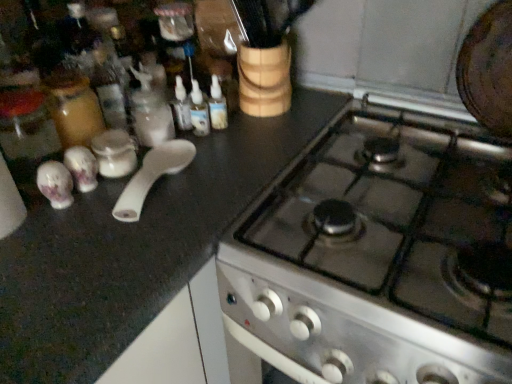
In order to click on white glossy spoon at upper left in this screenshot , I will do `click(114, 153)`.

What do you see at coordinates (400, 221) in the screenshot? This screenshot has width=512, height=384. I see `metallic silver gas stove at center` at bounding box center [400, 221].

Where is `metallic silver gas stove at center`? This screenshot has height=384, width=512. metallic silver gas stove at center is located at coordinates (400, 221).

In order to face translucent plastic bottles at center, the 2th bottle viewed from the right, should I rotate leftwards or rightwards?

You should look left and rotate roughly 7.684 degrees.

The height and width of the screenshot is (384, 512). Describe the element at coordinates (152, 176) in the screenshot. I see `white plastic spoon at left` at that location.

Find the location of a particular element. translucent plastic bottles at center, the 2th bottle from the left is located at coordinates (217, 105).

At what (x,y) coordinates should I click in order to perform the action: click on white glossy spoon at upper left. Please return your answer as a coordinate pair (x, y). Looking at the image, I should click on (114, 153).

Does translucent plastic bottles at center, the 2th bottle viewed from the right, have a greater height compared to white plastic spoon at left?

Yes, translucent plastic bottles at center, the 2th bottle viewed from the right, is taller than white plastic spoon at left.

Is white plastic spoon at left located within translucent plastic bottles at center, the 2th bottle viewed from the right?

Actually, white plastic spoon at left is outside translucent plastic bottles at center, the 2th bottle viewed from the right.

Is translucent plastic bottles at center, the 2th bottle viewed from the right, aimed at white plastic spoon at left?

No, translucent plastic bottles at center, the 2th bottle viewed from the right, is not aimed at white plastic spoon at left.

How much distance is there between translucent plastic bottles at center, the first bottle positioned from the left, and white plastic spoon at left?

translucent plastic bottles at center, the first bottle positioned from the left, is 6.07 inches away from white plastic spoon at left.

Is white glossy spoon at upper left positioned with its back to white glossy salt and pepper shakers at left?

No, white glossy spoon at upper left's orientation is not away from white glossy salt and pepper shakers at left.

Considering the sizes of objects white glossy spoon at upper left and white glossy salt and pepper shakers at left in the image provided, who is shorter, white glossy spoon at upper left or white glossy salt and pepper shakers at left?

With less height is white glossy spoon at upper left.

Between white glossy spoon at upper left and white glossy salt and pepper shakers at left, which one has larger size?

white glossy spoon at upper left.

Are metallic silver gas stove at center and translucent plastic bottles at center, the first bottle from the right, located far from each other?

That's not correct — metallic silver gas stove at center is a little close to translucent plastic bottles at center, the first bottle from the right.

Does metallic silver gas stove at center appear on the right side of translucent plastic bottles at center, the 2th bottle from the left?

Yes.

How many degrees apart are the facing directions of metallic silver gas stove at center and translucent plastic bottles at center, the 2th bottle from the left?

The facing directions of metallic silver gas stove at center and translucent plastic bottles at center, the 2th bottle from the left, are 90 degrees apart.

Is metallic silver gas stove at center positioned with its back to translucent plastic bottles at center, the first bottle from the right?

No, metallic silver gas stove at center's orientation is not away from translucent plastic bottles at center, the first bottle from the right.

Is translucent plastic bottles at center, the 2th bottle viewed from the right, oriented away from white glossy spoon at upper left?

translucent plastic bottles at center, the 2th bottle viewed from the right, does not have its back to white glossy spoon at upper left.

Which object is more forward, translucent plastic bottles at center, the first bottle positioned from the left, or white glossy spoon at upper left?

white glossy spoon at upper left is in front.

From a real-world perspective, relative to white glossy spoon at upper left, is translucent plastic bottles at center, the 2th bottle viewed from the right, vertically above or below?

translucent plastic bottles at center, the 2th bottle viewed from the right, is above white glossy spoon at upper left.

Is translucent plastic bottles at center, the first bottle positioned from the left, inside the boundaries of white glossy spoon at upper left, or outside?

translucent plastic bottles at center, the first bottle positioned from the left, cannot be found inside white glossy spoon at upper left.

Considering the relative sizes of white plastic spoon at left and white glossy salt and pepper shakers at left in the image provided, is white plastic spoon at left smaller than white glossy salt and pepper shakers at left?

No, white plastic spoon at left is not smaller than white glossy salt and pepper shakers at left.

The width and height of the screenshot is (512, 384). I want to click on tableware lying behind the white plastic spoon at left, so click(82, 168).

From the image's perspective, which is below, metallic silver gas stove at center or white glossy spoon at upper left?

metallic silver gas stove at center is shown below in the image.

Considering the sizes of metallic silver gas stove at center and white glossy spoon at upper left in the image, is metallic silver gas stove at center wider or thinner than white glossy spoon at upper left?

metallic silver gas stove at center is wider than white glossy spoon at upper left.

Which is correct: metallic silver gas stove at center is inside white glossy spoon at upper left, or outside of it?

metallic silver gas stove at center is not inside white glossy spoon at upper left, it's outside.

The height and width of the screenshot is (384, 512). What are the coordinates of `gas stove below the white glossy spoon at upper left (from a real-world perspective)` in the screenshot? It's located at (400, 221).

Would you say white glossy salt and pepper shakers at left is outside translucent plastic bottles at center, the 2th bottle from the left?

Yes.

Which is more to the left, white glossy salt and pepper shakers at left or translucent plastic bottles at center, the 2th bottle from the left?

white glossy salt and pepper shakers at left.

Looking at this image, is white glossy salt and pepper shakers at left looking in the opposite direction of translucent plastic bottles at center, the first bottle from the right?

No, white glossy salt and pepper shakers at left is not facing away from translucent plastic bottles at center, the first bottle from the right.

From the white plastic spoon at left, count 1st bottles backward and point to it. Please provide its 2D coordinates.

[(199, 111)]

The height and width of the screenshot is (384, 512). Find the location of `tableware to the left of white glossy spoon at upper left`. tableware to the left of white glossy spoon at upper left is located at coordinates (82, 168).

When comparing their distances from translucent plastic bottles at center, the 2th bottle viewed from the right, does white glossy salt and pepper shakers at left or translucent plastic bottles at center, the 2th bottle from the left, seem further?

Among the two, white glossy salt and pepper shakers at left is located further to translucent plastic bottles at center, the 2th bottle viewed from the right.

Looking at this image, considering their positions, is metallic silver gas stove at center positioned closer to translucent plastic bottles at center, the first bottle from the right, than translucent plastic bottles at center, the 2th bottle viewed from the right?

Among the two, translucent plastic bottles at center, the 2th bottle viewed from the right, is located nearer to translucent plastic bottles at center, the first bottle from the right.

Which object lies nearer to the anchor point white plastic spoon at left, translucent plastic bottles at center, the 2th bottle viewed from the right, or metallic silver gas stove at center?

translucent plastic bottles at center, the 2th bottle viewed from the right.

Which object lies further to the anchor point white plastic spoon at left, metallic silver gas stove at center or white glossy spoon at upper left?

metallic silver gas stove at center is further to white plastic spoon at left.

Based on their spatial positions, is translucent plastic bottles at center, the 2th bottle from the left, or white plastic spoon at left further from translucent plastic bottles at center, the 2th bottle viewed from the right?

white plastic spoon at left is positioned further to the anchor translucent plastic bottles at center, the 2th bottle viewed from the right.

Which object lies further to the anchor point translucent plastic bottles at center, the first bottle positioned from the left, white glossy spoon at upper left or metallic silver gas stove at center?

Based on the image, metallic silver gas stove at center appears to be further to translucent plastic bottles at center, the first bottle positioned from the left.

From the picture: Looking at the image, which one is located closer to white glossy salt and pepper shakers at left, translucent plastic bottles at center, the first bottle from the right, or white glossy spoon at upper left?

The object closer to white glossy salt and pepper shakers at left is white glossy spoon at upper left.

Looking at the image, which one is located closer to white glossy spoon at upper left, translucent plastic bottles at center, the first bottle positioned from the left, or translucent plastic bottles at center, the first bottle from the right?

translucent plastic bottles at center, the first bottle positioned from the left, lies closer to white glossy spoon at upper left than the other object.

What are the coordinates of `kitchen appliance between white glossy salt and pepper shakers at left and metallic silver gas stove at center` in the screenshot? It's located at (152, 176).

Where is `kitchen appliance between white glossy spoon at upper left and metallic silver gas stove at center from left to right`? The image size is (512, 384). kitchen appliance between white glossy spoon at upper left and metallic silver gas stove at center from left to right is located at coordinates (152, 176).

Locate an element on the screen. The width and height of the screenshot is (512, 384). kitchen appliance between white glossy salt and pepper shakers at left and translucent plastic bottles at center, the first bottle positioned from the left, from left to right is located at coordinates (152, 176).

Where is `bottle between white plastic spoon at left and translucent plastic bottles at center, the first bottle from the right, in the front-back direction`? bottle between white plastic spoon at left and translucent plastic bottles at center, the first bottle from the right, in the front-back direction is located at coordinates (199, 111).